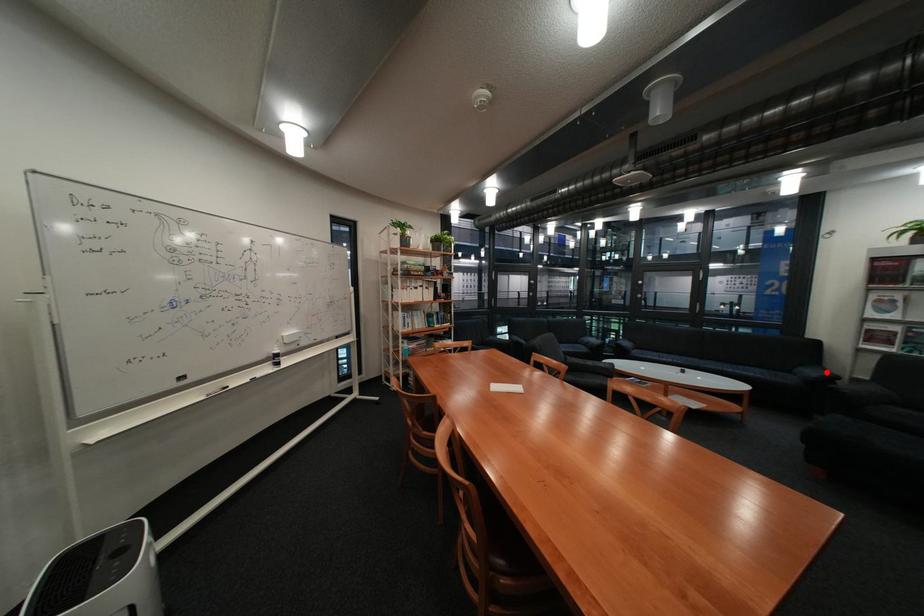
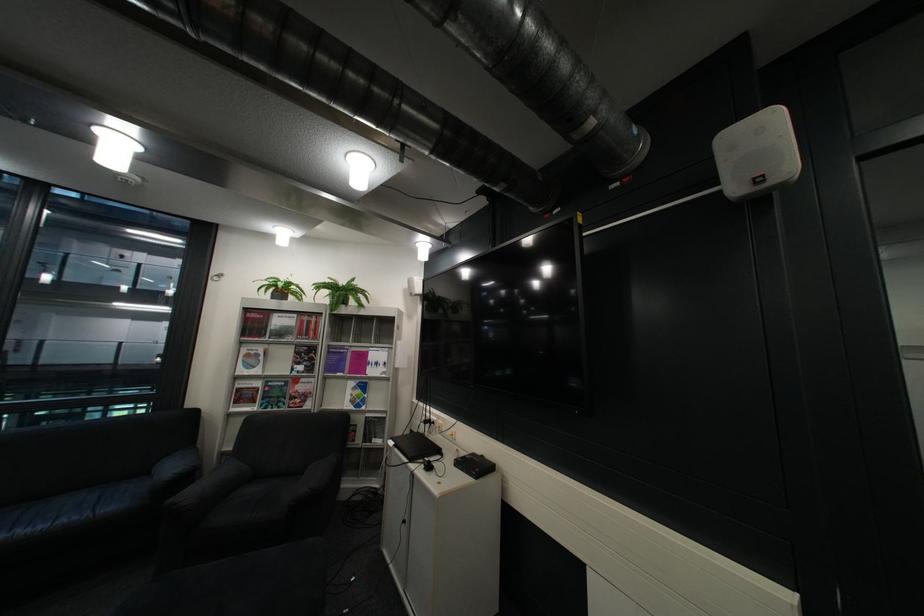
Find the pixel in the second image that matches the highlighted location in the first image.

(186, 468)